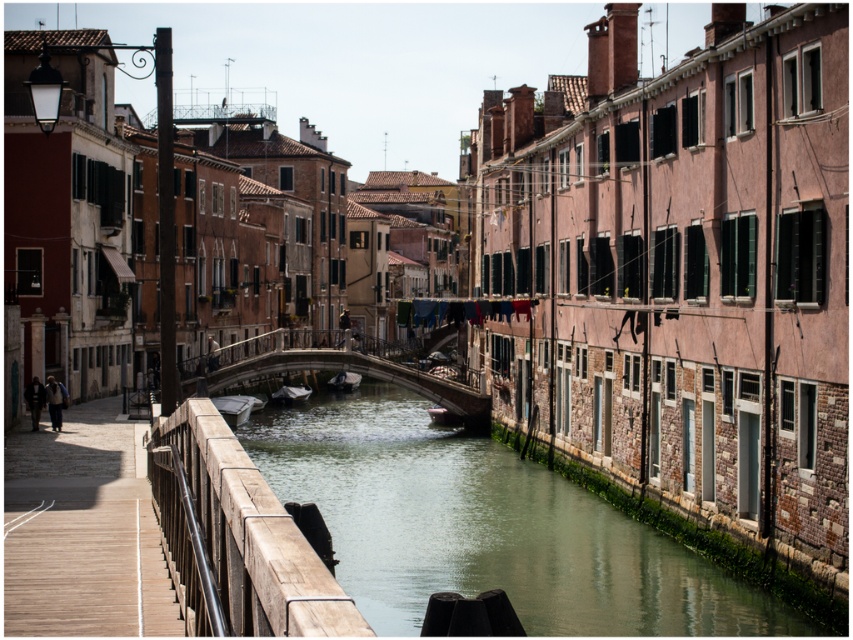
Which is more to the left, concrete stone bridge at center or white matte boat at center?

From the viewer's perspective, white matte boat at center appears more on the left side.

Does point (189, 392) come farther from viewer compared to point (241, 406)?

No, (189, 392) is closer to viewer.

Measure the distance between point (215, 381) and camera.

302.46 feet

Identify the location of concrete stone bridge at center. point(332,371).

Does dark gray wooden boat at center have a lesser height compared to dark brown wooden boat at center?

Yes.

Is dark gray wooden boat at center closer to the viewer compared to dark brown wooden boat at center?

No, dark gray wooden boat at center is further to the viewer.

Where is `dark gray wooden boat at center`? The height and width of the screenshot is (640, 853). dark gray wooden boat at center is located at coordinates (289, 394).

What are the coordinates of `dark gray wooden boat at center` in the screenshot? It's located at (289, 394).

Looking at this image, how distant is wooden rail at lower left from concrete stone bridge at center?

172.93 feet

This screenshot has height=640, width=853. What do you see at coordinates (235, 538) in the screenshot?
I see `wooden rail at lower left` at bounding box center [235, 538].

Between point (170, 456) and point (260, 337), which one is positioned in front?

Point (170, 456)

Locate an element on the screen. wooden rail at lower left is located at coordinates (235, 538).